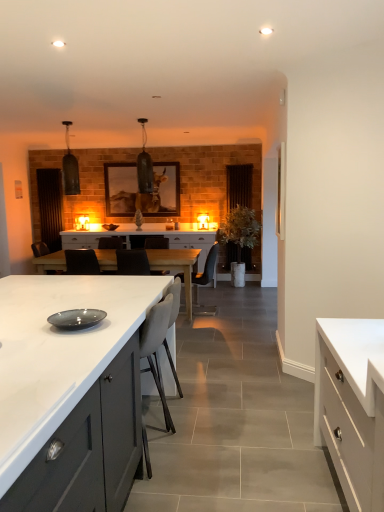
Question: Considering their positions, is white matte cabinet at center, which is the third cabinetry from back to front, located in front of or behind transparent glass door at center, which is the 2th glass door in left-to-right order?

Choices:
 (A) behind
 (B) front

Answer: (B)

Question: Based on their sizes in the image, would you say white matte cabinet at center, which is the third cabinetry from back to front, is bigger or smaller than transparent glass door at center, which appears as the first glass door when viewed from the right?

Choices:
 (A) big
 (B) small

Answer: (A)

Question: Based on their relative distances, which object is farther from the brown wooden door at left, acting as the 2th glass door starting from the right?

Choices:
 (A) matte gray plate at center
 (B) white glossy cabinet at center, which appears as the 3th cabinetry when viewed from the front
 (C) leather armchair at center, positioned as the 2th armchair in front-to-back order
 (D) white glossy table at center
 (E) white matte cabinet at right, the 2th cabinetry from the front

Answer: (E)

Question: Which is nearer to the white glossy table at center?

Choices:
 (A) brown wooden door at left, acting as the 2th glass door starting from the right
 (B) white matte cabinet at right, positioned as the 1th cabinetry in right-to-left order
 (C) white glossy cabinet at center, which appears as the 3th cabinetry when viewed from the front
 (D) matte gray plate at center
 (E) leather armchair at center, positioned as the 2th armchair in front-to-back order

Answer: (C)